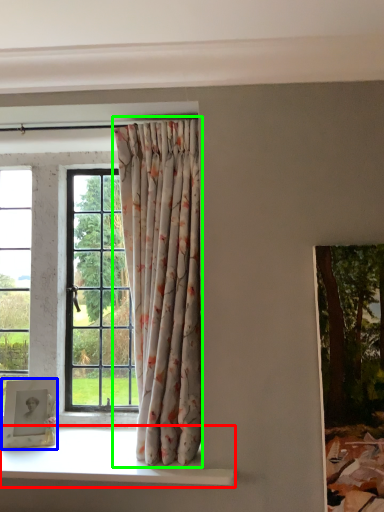
Question: Estimate the real-world distances between objects in this image. Which object is closer to window sill (highlighted by a red box), picture frame (highlighted by a blue box) or curtain (highlighted by a green box)?

Choices:
 (A) picture frame
 (B) curtain

Answer: (A)